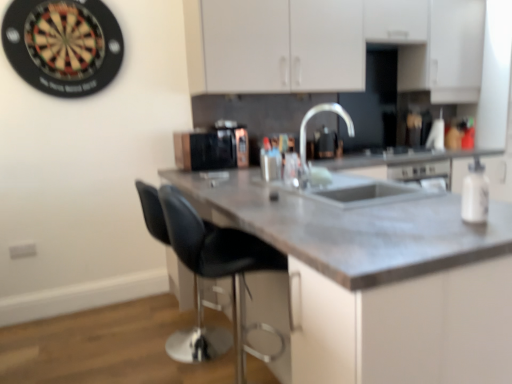
The width and height of the screenshot is (512, 384). Find the location of `black leather swivel chair at lower left`. black leather swivel chair at lower left is located at coordinates (198, 338).

Measure the distance between white matte bottle at right and camera.

They are 3.92 feet apart.

The width and height of the screenshot is (512, 384). I want to click on satin nickel faucet at center, so click(315, 114).

Describe the element at coordinates (315, 114) in the screenshot. I see `satin nickel faucet at center` at that location.

At what (x,y) coordinates should I click in order to perform the action: click on white matte cabinet at upper center. Please return your answer as a coordinate pair (x, y). Image resolution: width=512 pixels, height=384 pixels. Looking at the image, I should click on (332, 45).

Considering the sizes of objects matte gray countertop at center and white matte bottle at right in the image provided, who is thinner, matte gray countertop at center or white matte bottle at right?

Thinner between the two is white matte bottle at right.

Is there a large distance between matte gray countertop at center and white matte bottle at right?

No, matte gray countertop at center is not far away from white matte bottle at right.

Is matte gray countertop at center looking in the opposite direction of white matte bottle at right?

No, matte gray countertop at center's orientation is not away from white matte bottle at right.

Based on their sizes in the image, would you say matte gray countertop at center is bigger or smaller than white matte bottle at right?

matte gray countertop at center is bigger than white matte bottle at right.

Which object is further away from the camera taking this photo, white matte cabinet at upper center or black matte microwave at center?

black matte microwave at center is more distant.

Consider the image. Between white matte cabinet at upper center and black matte microwave at center, which one has larger width?

black matte microwave at center.

From their relative heights in the image, would you say white matte cabinet at upper center is taller or shorter than black matte microwave at center?

Clearly, white matte cabinet at upper center is taller compared to black matte microwave at center.

Looking at this image, is white matte cabinet at upper center with matte gray countertop at center?

No, white matte cabinet at upper center is not making contact with matte gray countertop at center.

Is white matte cabinet at upper center positioned before matte gray countertop at center?

No.

Find the location of a particular element. The height and width of the screenshot is (384, 512). cabinetry above the matte gray countertop at center (from the image's perspective) is located at coordinates (332, 45).

Which is behind, black leather swivel chair at lower left or matte gray countertop at center?

black leather swivel chair at lower left is behind.

Looking at this image, considering the relative positions of black leather swivel chair at lower left and matte gray countertop at center in the image provided, is black leather swivel chair at lower left to the left of matte gray countertop at center from the viewer's perspective?

Yes, black leather swivel chair at lower left is to the left of matte gray countertop at center.

Is black leather swivel chair at lower left bigger than matte gray countertop at center?

Answer: No.

From the image's perspective, is black leather swivel chair at lower left beneath matte gray countertop at center?

No, from the image's perspective, black leather swivel chair at lower left is not below matte gray countertop at center.

Can you confirm if satin nickel faucet at center is taller than matte gray countertop at center?

No, satin nickel faucet at center is not taller than matte gray countertop at center.

From a real-world perspective, is satin nickel faucet at center below matte gray countertop at center?

Incorrect, from a real-world perspective, satin nickel faucet at center is higher than matte gray countertop at center.

Can you tell me how much satin nickel faucet at center and matte gray countertop at center differ in facing direction?

51.4 degrees separate the facing orientations of satin nickel faucet at center and matte gray countertop at center.

From the image's perspective, relative to matte gray countertop at center, is satin nickel faucet at center above or below?

satin nickel faucet at center is above matte gray countertop at center.

Which is closer, (177, 238) or (466, 185)?

The point (466, 185) is closer to the camera.

From a real-world perspective, is black leather stool at center located beneath white matte bottle at right?

Correct, in the physical world, black leather stool at center is lower than white matte bottle at right.

Does black leather stool at center have a smaller size compared to white matte bottle at right?

Incorrect, black leather stool at center is not smaller in size than white matte bottle at right.

Can you confirm if black leather stool at center is wider than white matte bottle at right?

Correct, the width of black leather stool at center exceeds that of white matte bottle at right.

What's the angular difference between white matte bottle at right and black matte microwave at center's facing directions?

The angular difference between white matte bottle at right and black matte microwave at center is 92.3 degrees.

From the image's perspective, which one is positioned lower, white matte bottle at right or black matte microwave at center?

white matte bottle at right, from the image's perspective.

Is white matte bottle at right oriented away from black matte microwave at center?

No, white matte bottle at right's orientation is not away from black matte microwave at center.

Considering the relative positions of white matte bottle at right and black matte microwave at center in the image provided, is white matte bottle at right to the left of black matte microwave at center from the viewer's perspective?

In fact, white matte bottle at right is to the right of black matte microwave at center.

You are a GUI agent. You are given a task and a screenshot of the screen. Output one action in this format:
    pyautogui.click(x=<x>, y=<y>)
    Task: Click on the countertop to the left of white matte bottle at right
    
    Given the screenshot: What is the action you would take?
    pyautogui.click(x=380, y=282)

You are a GUI agent. You are given a task and a screenshot of the screen. Output one action in this format:
    pyautogui.click(x=<x>, y=<y>)
    Task: Click on the appliance below the white matte cabinet at upper center (from a real-world perspective)
    
    Given the screenshot: What is the action you would take?
    pyautogui.click(x=205, y=150)

Estimate the real-world distances between objects in this image. Which object is closer to black matte microwave at center, satin nickel faucet at center or white matte bottle at right?

satin nickel faucet at center lies closer to black matte microwave at center than the other object.

Considering their positions, is black leather stool at center positioned closer to black leather swivel chair at lower left than black matte microwave at center?

Among the two, black matte microwave at center is located nearer to black leather swivel chair at lower left.

Considering their positions, is black leather stool at center positioned closer to black matte microwave at center than white matte bottle at right?

Based on the image, black leather stool at center appears to be nearer to black matte microwave at center.

Which object lies nearer to the anchor point black matte microwave at center, white matte cabinet at upper center or black leather stool at center?

white matte cabinet at upper center is positioned closer to the anchor black matte microwave at center.

Looking at the image, which one is located closer to satin nickel faucet at center, white matte bottle at right or black leather swivel chair at lower left?

black leather swivel chair at lower left is positioned closer to the anchor satin nickel faucet at center.

Looking at the image, which one is located further to white matte cabinet at upper center, white matte bottle at right or black matte microwave at center?

white matte bottle at right is positioned further to the anchor white matte cabinet at upper center.

Considering their positions, is black matte microwave at center positioned further to black leather stool at center than white matte bottle at right?

black matte microwave at center.

From the image, which object appears to be nearer to white matte cabinet at upper center, white matte bottle at right or black leather swivel chair at lower left?

black leather swivel chair at lower left lies closer to white matte cabinet at upper center than the other object.

This screenshot has height=384, width=512. I want to click on tap between black leather stool at center and white matte bottle at right, so coord(315,114).

At what (x,y) coordinates should I click in order to perform the action: click on bottle between matte gray countertop at center and white matte cabinet at upper center along the z-axis. Please return your answer as a coordinate pair (x, y). This screenshot has height=384, width=512. Looking at the image, I should click on (475, 193).

The width and height of the screenshot is (512, 384). What are the coordinates of `chair between matte gray countertop at center and black matte microwave at center from front to back` in the screenshot? It's located at (221, 262).

Identify the location of bottle positioned between matte gray countertop at center and satin nickel faucet at center from near to far. click(475, 193).